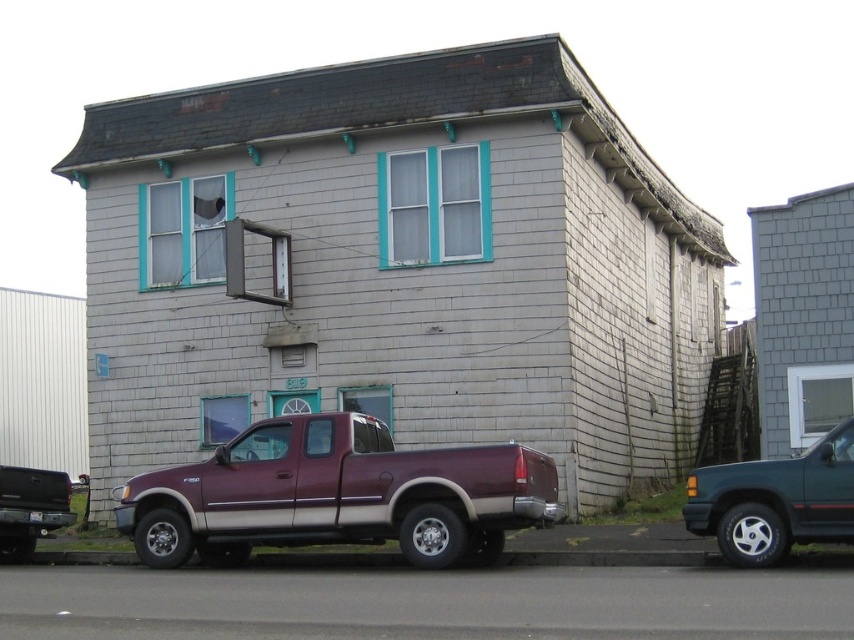
Does maroon metallic truck at center appear over metallic maroon truck at center?

Incorrect, maroon metallic truck at center is not positioned above metallic maroon truck at center.

Does maroon metallic truck at center come in front of metallic maroon truck at center?

No, it is behind metallic maroon truck at center.

Where is `maroon metallic truck at center`? The height and width of the screenshot is (640, 854). maroon metallic truck at center is located at coordinates (337, 496).

Can you confirm if maroon metallic truck at center is positioned above maroon matte truck at center?

Yes, maroon metallic truck at center is above maroon matte truck at center.

Who is positioned more to the right, maroon metallic truck at center or maroon matte truck at center?

From the viewer's perspective, maroon metallic truck at center appears more on the right side.

Is point (343, 483) positioned after point (3, 557)?

That is False.

What are the coordinates of `maroon metallic truck at center` in the screenshot? It's located at (337, 496).

The height and width of the screenshot is (640, 854). I want to click on metallic maroon truck at center, so pyautogui.click(x=775, y=500).

Identify the location of metallic maroon truck at center. (775, 500).